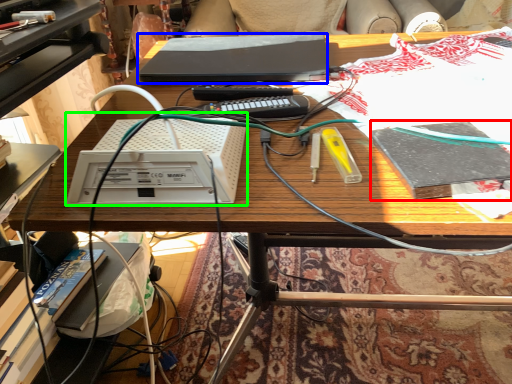
Question: Estimate the real-world distances between objects in this image. Which object is closer to book (highlighted by a red box), computer (highlighted by a blue box) or equipment (highlighted by a green box)?

Choices:
 (A) computer
 (B) equipment

Answer: (B)